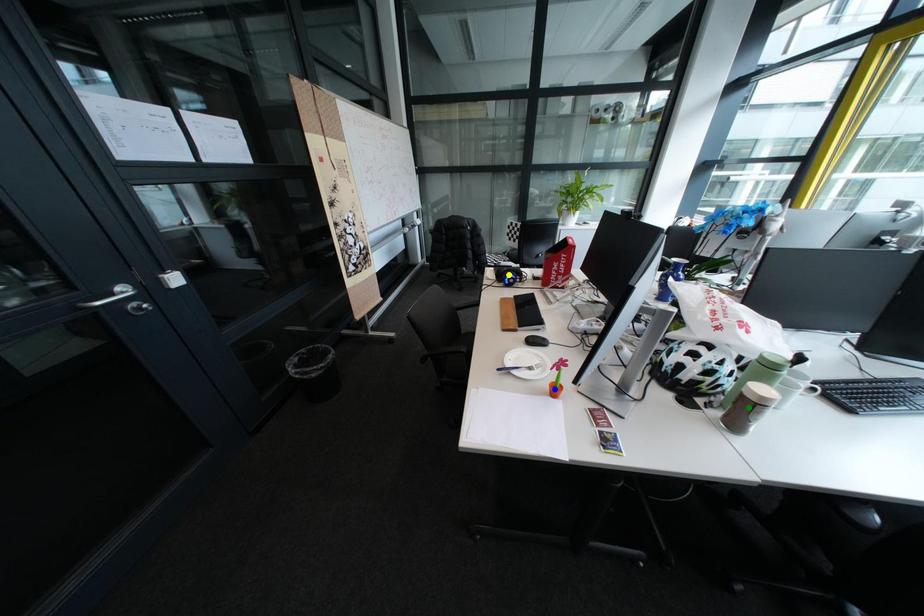
Order these from farthest to nearest:
A) yellow point
B) green point
C) blue point

1. yellow point
2. blue point
3. green point